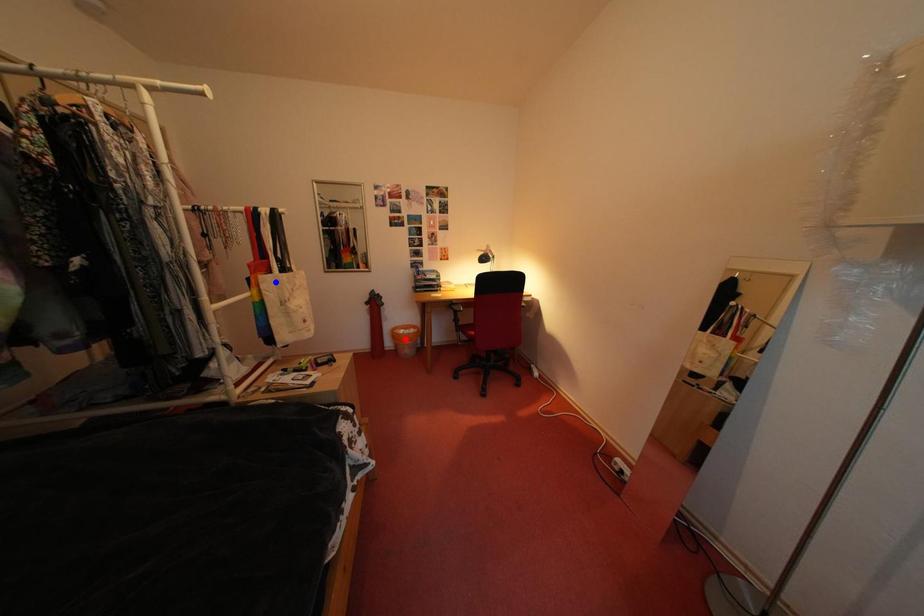
Question: Which of the two points in the image is closer to the camera?

Choices:
 (A) Blue point is closer.
 (B) Red point is closer.

Answer: (A)